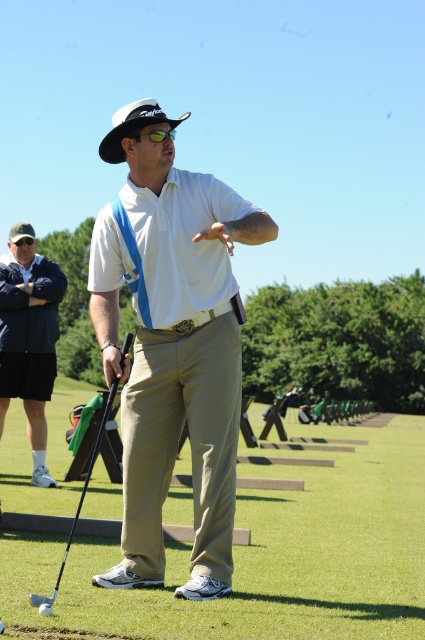
Question: Which point appears farthest from the camera in this image?

Choices:
 (A) (40, 611)
 (B) (127, 348)
 (C) (11, 369)

Answer: (C)

Question: Does white matte shirt at center have a larger size compared to dark blue jacket at left?

Choices:
 (A) no
 (B) yes

Answer: (B)

Question: Considering the real-world distances, which object is closest to the shiny black golf club at center?

Choices:
 (A) khaki fabric pants at center
 (B) dark blue jacket at left
 (C) matte black golf club at lower left
 (D) white matte shirt at center

Answer: (C)

Question: Which of the following is the farthest from the observer?

Choices:
 (A) (136, 621)
 (B) (0, 262)

Answer: (B)

Question: Does khaki fabric pants at center appear on the left side of matte black golf club at lower left?

Choices:
 (A) yes
 (B) no

Answer: (B)

Question: Where is khaki fabric pants at center located in relation to dark blue jacket at left in the image?

Choices:
 (A) right
 (B) left

Answer: (A)